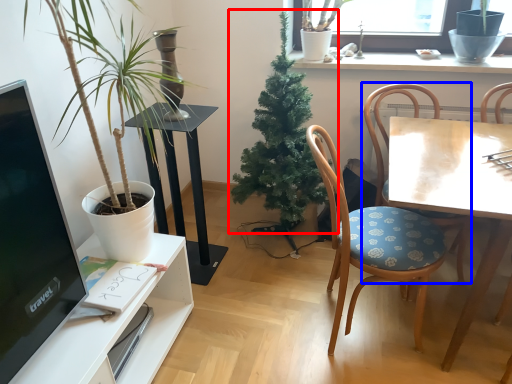
Question: Which of the following is the farthest to the observer, houseplant (highlighted by a red box) or chair (highlighted by a blue box)?

Choices:
 (A) houseplant
 (B) chair

Answer: (A)